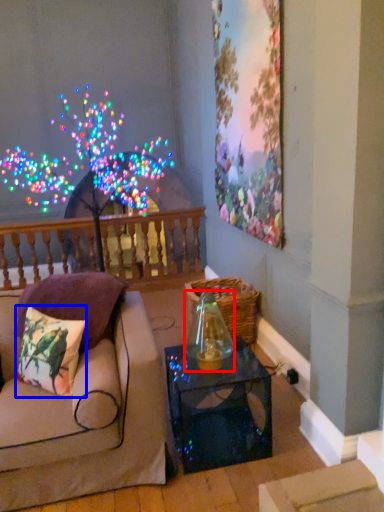
Question: Which point is further to the camera, glass vase (highlighted by a red box) or pillow (highlighted by a blue box)?

Choices:
 (A) glass vase
 (B) pillow

Answer: (A)